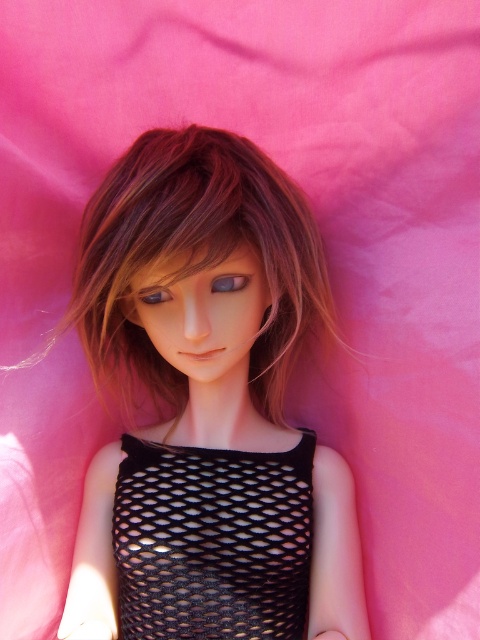
What do you see at coordinates (207, 406) in the screenshot? I see `satin black dress at center` at bounding box center [207, 406].

Which of these two, satin black dress at center or purple glossy eye at center, stands shorter?

purple glossy eye at center

Who is more distant from viewer, (x=207, y=291) or (x=218, y=291)?

The point (x=218, y=291) is behind.

Image resolution: width=480 pixels, height=640 pixels. What are the coordinates of `satin black dress at center` in the screenshot? It's located at (207, 406).

Does black mesh dress at center have a larger size compared to satin blue eye at center?

Correct, black mesh dress at center is larger in size than satin blue eye at center.

Which is in front, point (195, 504) or point (152, 289)?

Point (152, 289) is in front.

Identify the location of black mesh dress at center. (213, 541).

You are a GUI agent. You are given a task and a screenshot of the screen. Output one action in this format:
    pyautogui.click(x=<x>, y=<y>)
    Task: Click on the black mesh dress at center
    Image resolution: width=480 pixels, height=640 pixels.
    Given the screenshot: What is the action you would take?
    pyautogui.click(x=213, y=541)

Is satin black dress at center to the left of satin blue eye at center from the viewer's perspective?

No, satin black dress at center is not to the left of satin blue eye at center.

Is satin black dress at center taller than satin blue eye at center?

Correct, satin black dress at center is much taller as satin blue eye at center.

Where is `satin black dress at center`? The width and height of the screenshot is (480, 640). satin black dress at center is located at coordinates tap(207, 406).